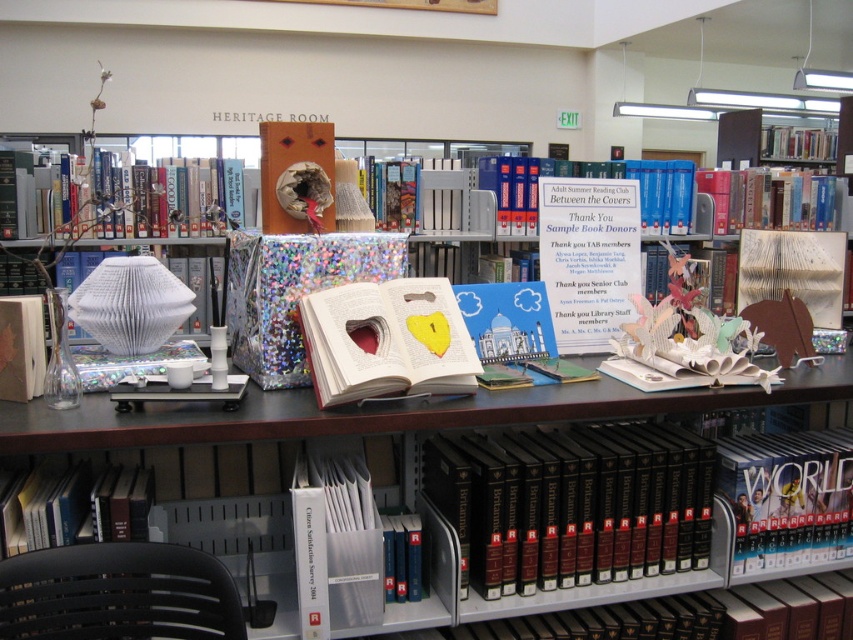
You are organizing a display in the Heritage Room library. You have a matte paper book at center and a hardcover book at left. Which book should you place on the lower shelf if you want to follow the rule of arranging books from tallest to shortest from top to bottom shelves?

The matte paper book at center is shorter than the hardcover book at left, so you should place the matte paper book at center on the lower shelf and the hardcover book at left on the higher shelf to follow the tallest to shortest arrangement.

You are a librarian who needs to place a new book on the shelf. The new book is 2.5 meters wide. There are two existing books on the shelf labeled as hardcover book at lower right and hardcover book at upper right. Can the new book fit between them?

The distance between the hardcover book at lower right and hardcover book at upper right is 2.42 meters. Since the new book is 2.5 meters wide, it cannot fit between them as the space is slightly smaller than the book.

You are organizing the Heritage Room library and need to place a new book on the shelf. The shelf has limited space. Which book, the hardcover book at lower right or the hardcover book at upper right, would require less space on the shelf?

The hardcover book at lower right occupies less space than the hardcover book at upper right, so it would require less space on the shelf.